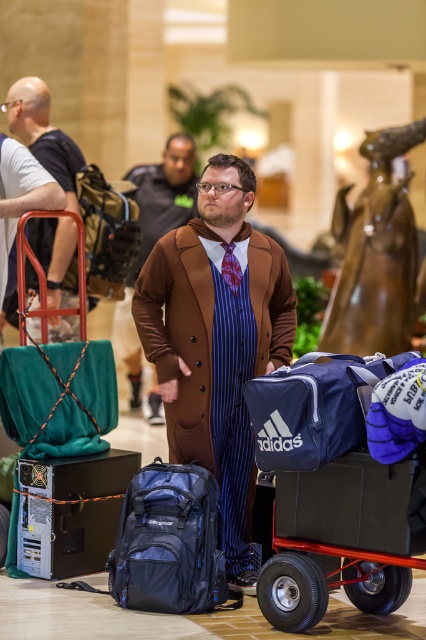
You are a guest in this hotel lobby and notice two items at center. The camouflage fabric backpack at center and the patterned silk tie at center. Which item is positioned to the left?

The camouflage fabric backpack at center is to the left of the patterned silk tie at center.

You are organizing a charity event and need to decide whether to place a large donation box on the blue fabric cart at center or the patterned silk tie at center. Based on their sizes, which object can accommodate the donation box?

The blue fabric cart at center is bigger than the patterned silk tie at center, so the donation box should be placed on the blue fabric cart at center.

You are a photographer positioned in the hotel lobby. You want to take a photo of the man in the blue pinstripe suit. However, you notice that the camouflage fabric backpack at center and the patterned silk tie at center might block your view. Which object is closer to you and could potentially obstruct the shot?

The camouflage fabric backpack at center is closer to you than the patterned silk tie at center, so it is the object that could potentially obstruct your view of the man in the blue pinstripe suit.